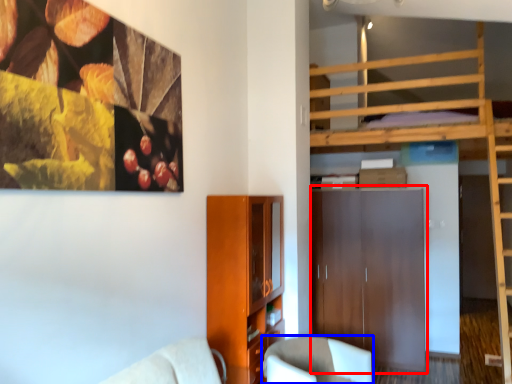
Question: Which point is closer to the camera, dresser (highlighted by a red box) or chair (highlighted by a blue box)?

Choices:
 (A) dresser
 (B) chair

Answer: (B)